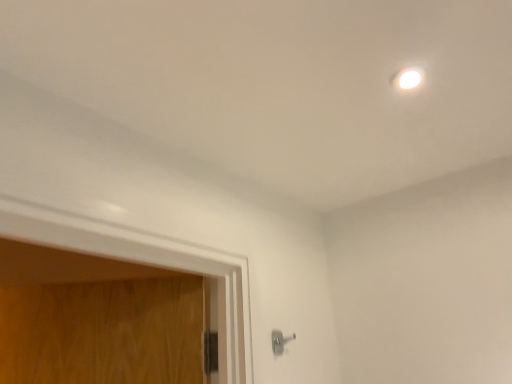
Describe the element at coordinates (280, 341) in the screenshot. I see `silver metallic door handle at lower center` at that location.

The image size is (512, 384). What are the coordinates of `silver metallic door handle at lower center` in the screenshot? It's located at (280, 341).

Identify the location of silver metallic door handle at lower center. The image size is (512, 384). (280, 341).